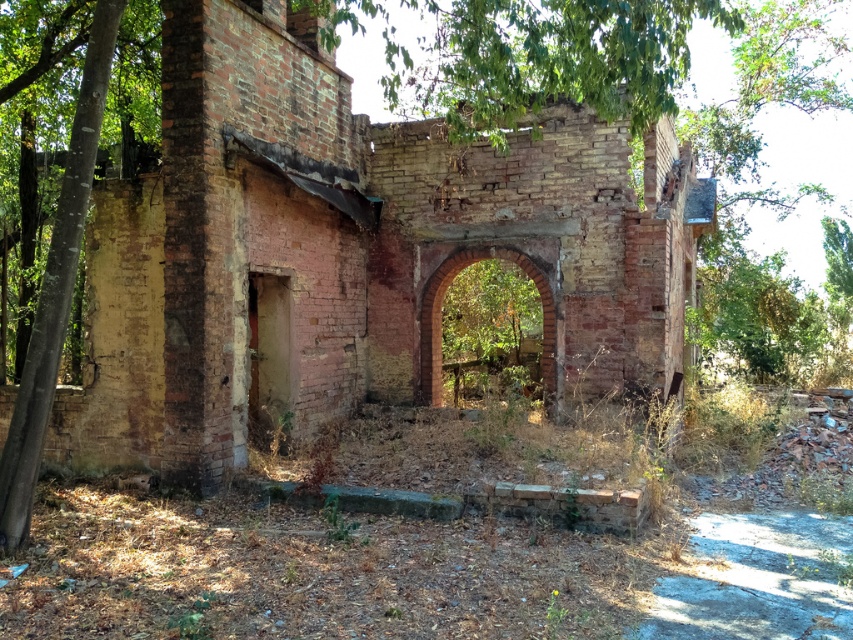
Can you confirm if rusty brick ruins at center is shorter than red brick archway at center?

Yes, rusty brick ruins at center is shorter than red brick archway at center.

Who is positioned more to the left, rusty brick ruins at center or red brick archway at center?

From the viewer's perspective, rusty brick ruins at center appears more on the left side.

The image size is (853, 640). What do you see at coordinates (351, 252) in the screenshot? I see `rusty brick ruins at center` at bounding box center [351, 252].

Locate an element on the screen. The height and width of the screenshot is (640, 853). rusty brick ruins at center is located at coordinates (351, 252).